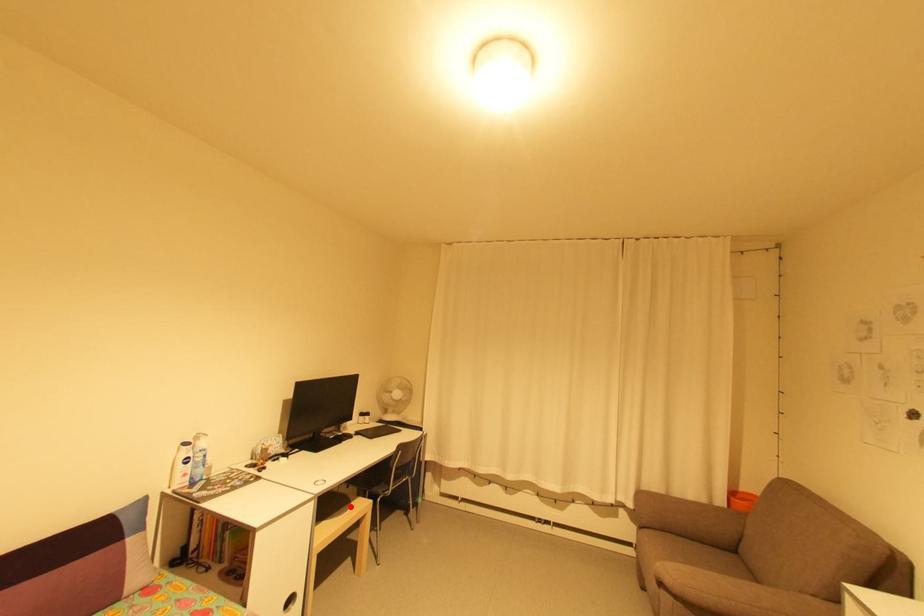
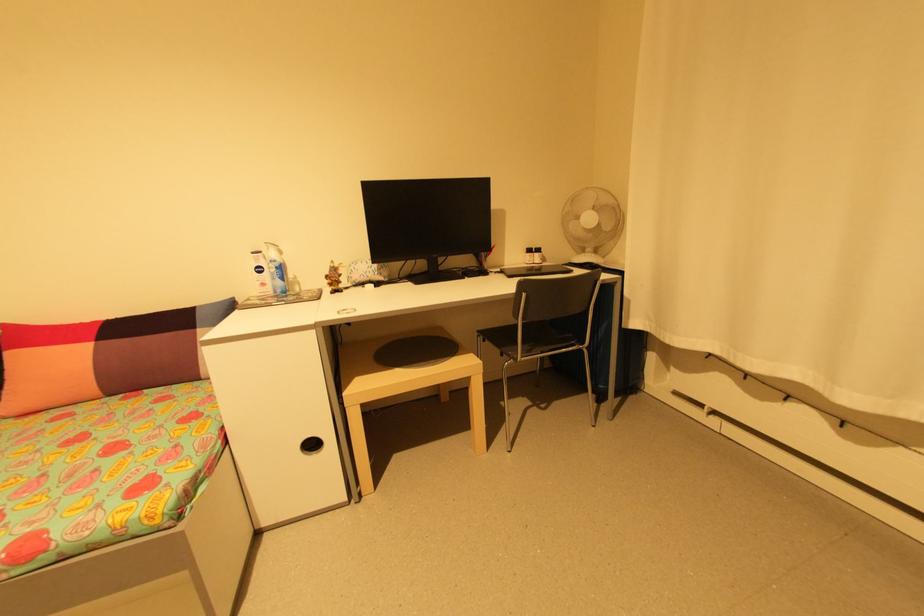
Question: I am providing you with two images of the same scene from different viewpoints. In image1, a red point is highlighted. Considering the same 3D point in image2, which of the following is correct?

Choices:
 (A) It is closer
 (B) It is farther

Answer: (B)